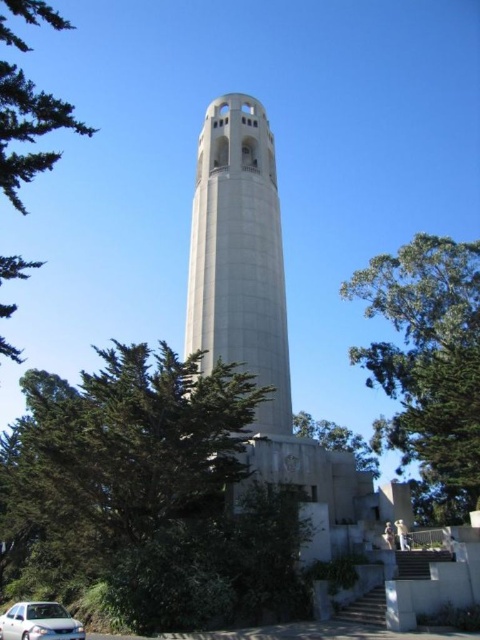
Question: Which point is closer to the camera taking this photo?

Choices:
 (A) (250, 301)
 (B) (38, 628)

Answer: (B)

Question: Which point is farther to the camera?

Choices:
 (A) white matte car at lower left
 (B) green leafy tree at left

Answer: (B)

Question: Does green leafy tree at center have a smaller size compared to white matte car at lower left?

Choices:
 (A) no
 (B) yes

Answer: (A)

Question: Can you confirm if green leafy tree at center is thinner than white concrete tower at center?

Choices:
 (A) yes
 (B) no

Answer: (B)

Question: Is green leafy tree at left bigger than white matte car at lower left?

Choices:
 (A) yes
 (B) no

Answer: (A)

Question: Which is nearer to the green leafy tree at upper right?

Choices:
 (A) green leafy tree at center
 (B) white matte car at lower left
 (C) white concrete tower at center

Answer: (C)